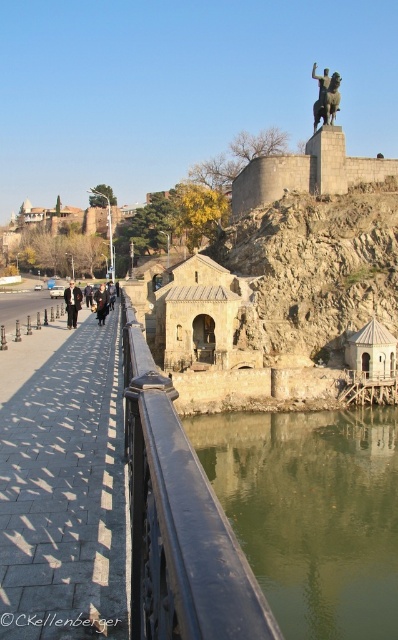
Based on the photo, can you confirm if black concrete sidewalk at center is smaller than dark brown leather jacket at left?

Yes, black concrete sidewalk at center is smaller than dark brown leather jacket at left.

Between black concrete sidewalk at center and dark brown leather jacket at left, which one has less height?

black concrete sidewalk at center

Consider the image. Who is more forward, [54,570] or [68,305]?

Positioned in front is point [54,570].

This screenshot has height=640, width=398. Identify the location of black concrete sidewalk at center. (66, 493).

Which is more to the left, green reflective water at lower center or bronze statue at upper center?

Positioned to the left is green reflective water at lower center.

Looking at this image, can you confirm if green reflective water at lower center is positioned to the left of bronze statue at upper center?

Yes, green reflective water at lower center is to the left of bronze statue at upper center.

This screenshot has width=398, height=640. Describe the element at coordinates (312, 513) in the screenshot. I see `green reflective water at lower center` at that location.

At what (x,y) coordinates should I click in order to perform the action: click on green reflective water at lower center. Please return your answer as a coordinate pair (x, y). This screenshot has height=640, width=398. Looking at the image, I should click on (312, 513).

Which of these two, green reflective water at lower center or black metal railing at center, stands shorter?

With less height is black metal railing at center.

Is point (288, 561) positioned before point (132, 352)?

No, it is not.

Locate an element on the screen. The height and width of the screenshot is (640, 398). green reflective water at lower center is located at coordinates (312, 513).